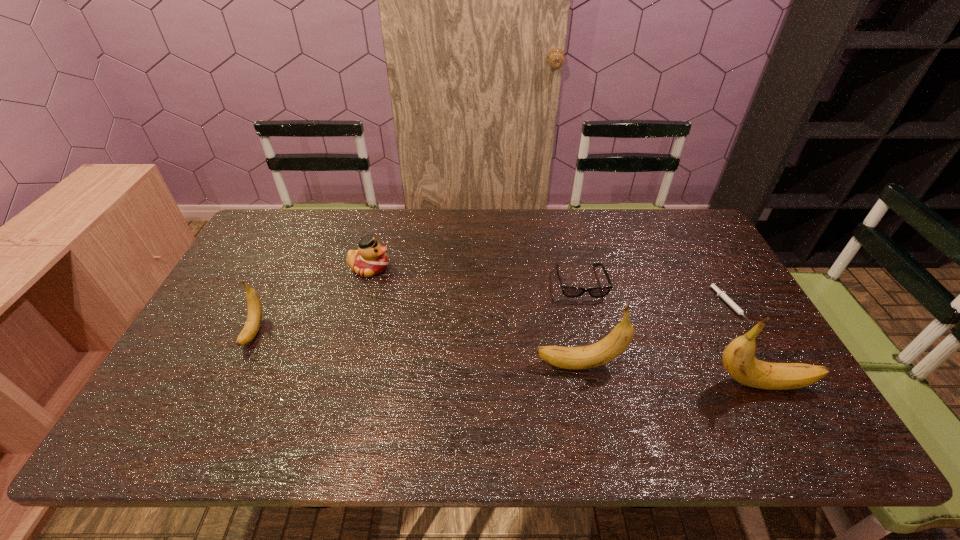
Where is `object at the near right corner`? object at the near right corner is located at coordinates (738, 358).

In the image, there is a desktop. Identify the location of vacant space at the far edge. This screenshot has width=960, height=540. (587, 228).

Image resolution: width=960 pixels, height=540 pixels. Identify the location of vacant region at the near edge of the desktop. (702, 405).

What are the coordinates of `vacant space at the left edge of the desktop` in the screenshot? It's located at (230, 339).

In order to click on free spot at the right edge of the desktop in this screenshot , I will do `click(676, 273)`.

Where is `vacant space at the far right corner of the desktop`? vacant space at the far right corner of the desktop is located at coordinates (691, 237).

The width and height of the screenshot is (960, 540). In order to click on free space between the shortest object and the leftmost object in this screenshot , I will do `click(492, 319)`.

At what (x,y) coordinates should I click in order to perform the action: click on vacant point located between the rightmost banana and the fifth tallest object. Please return your answer as a coordinate pair (x, y). Image resolution: width=960 pixels, height=540 pixels. Looking at the image, I should click on (670, 333).

Identify the location of vacant area that lies between the farthest banana and the rightmost banana. The image size is (960, 540). (507, 357).

Find the location of a particular element. This screenshot has height=540, width=960. unoccupied area between the shortest object and the third tallest object is located at coordinates (492, 319).